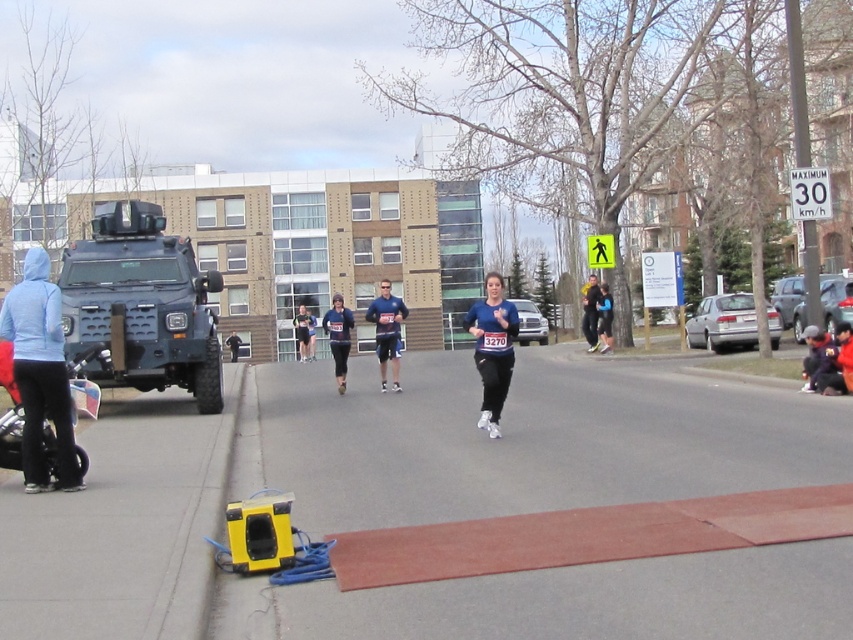
You are a photographer positioned at the center of the image. You want to capture a photo of the light blue hoodie at left. Which direction should you move your camera to frame it properly?

The light blue hoodie at left is located at point 0.581 on the x axis and 0.048 on the y axis. Since the photographer is at the center, they should move the camera to the left and down to frame the light blue hoodie at left properly.

You are standing at the point marked by the coordinates point (482, 314) in the image, which is part of a marathon scene. You want to know how far you are from the viewer. Can you determine the distance?

The point (482, 314) is 37.13 feet away from the viewer.